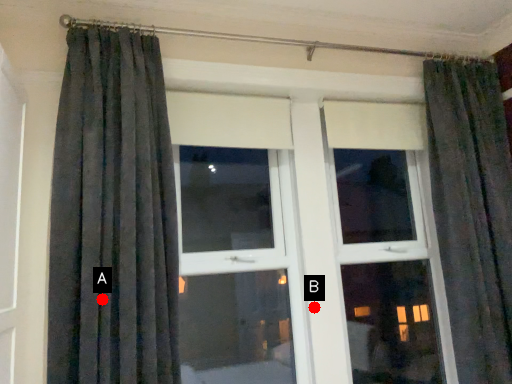
Question: Two points are circled on the image, labeled by A and B beside each circle. Which of the following is the farthest from the observer?

Choices:
 (A) A is further
 (B) B is further

Answer: (B)